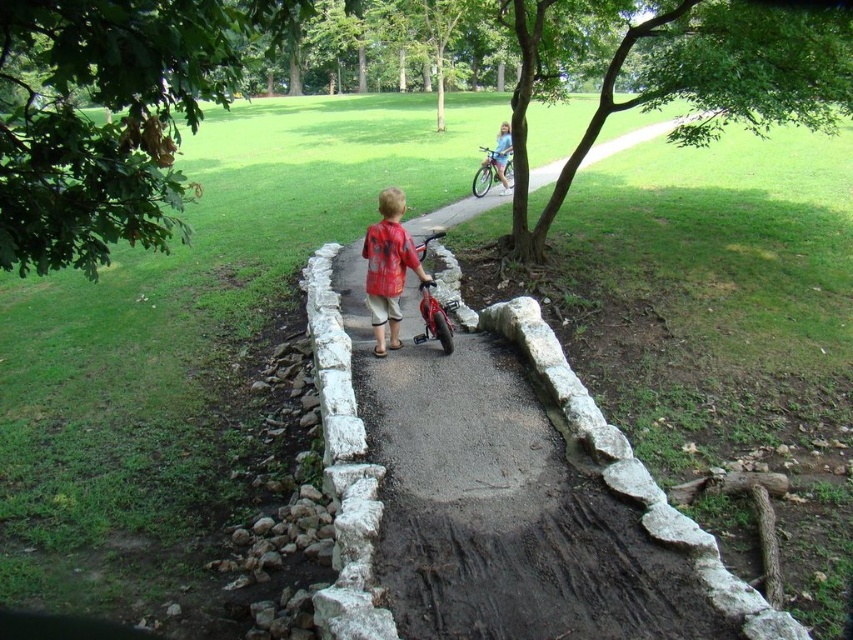
Question: Is smooth concrete path at center to the right of green leafy tree at upper left from the viewer's perspective?

Choices:
 (A) yes
 (B) no

Answer: (A)

Question: Which is farther from the green leafy tree at upper left?

Choices:
 (A) smooth concrete path at center
 (B) green leafy tree at upper right
 (C) metallic silver bicycle at upper right
 (D) red matte shirt at center

Answer: (C)

Question: Based on their relative distances, which object is farther from the green leafy tree at upper left?

Choices:
 (A) red matte shirt at center
 (B) green leafy tree at upper right
 (C) shiny red bicycle at center
 (D) metallic silver bicycle at upper right

Answer: (C)

Question: Which point is closer to the camera taking this photo?

Choices:
 (A) (440, 429)
 (B) (761, 65)
 (C) (398, 269)
 (D) (132, 83)

Answer: (D)

Question: From the image, what is the correct spatial relationship of red matte shirt at center in relation to metallic silver bicycle at upper right?

Choices:
 (A) left
 (B) right

Answer: (A)

Question: Is green leafy tree at upper left positioned in front of shiny red bicycle at center?

Choices:
 (A) yes
 (B) no

Answer: (A)